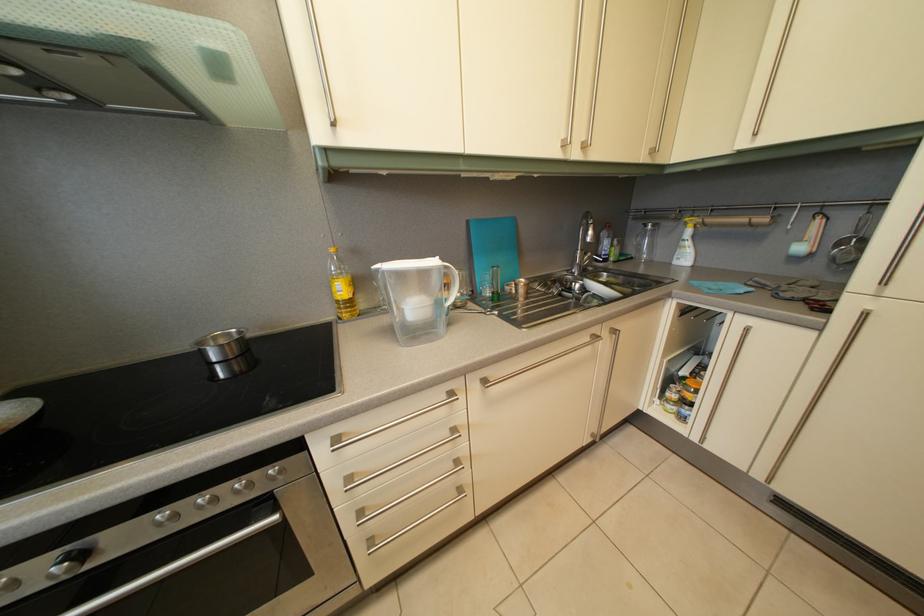
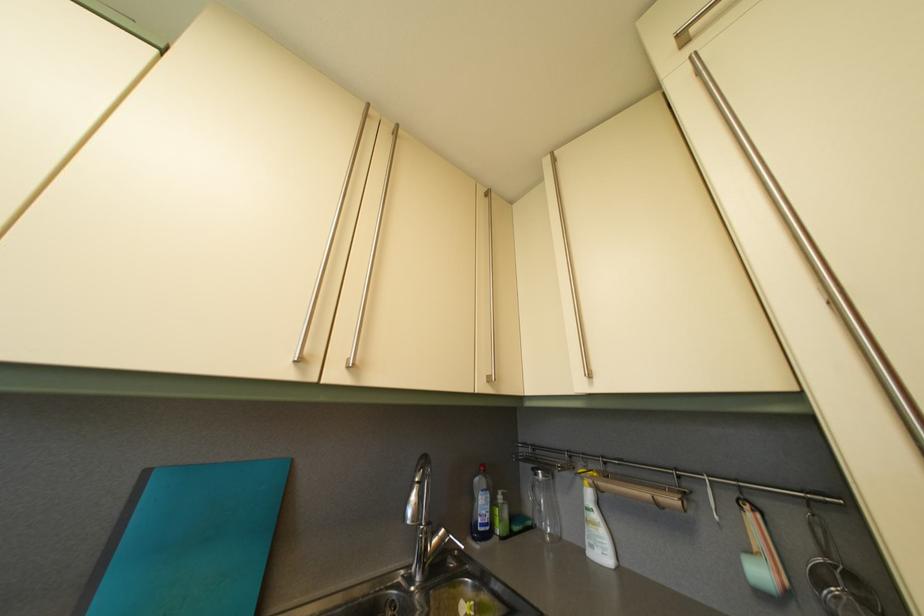
Locate, in the second image, the point that corresponds to (694,232) in the first image.

(590, 485)